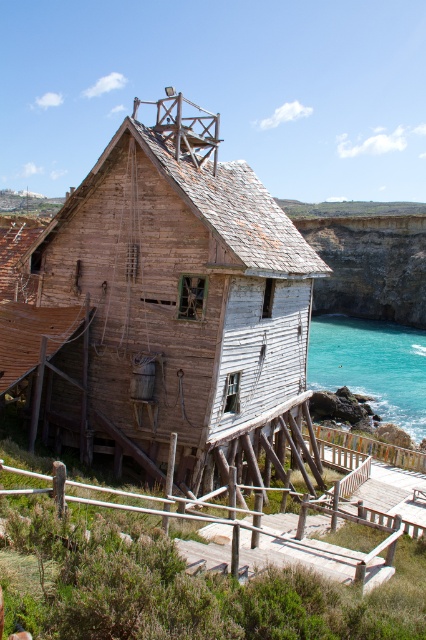
Question: Is weathered wood hut at center to the right of rugged stone cliff at right from the viewer's perspective?

Choices:
 (A) no
 (B) yes

Answer: (A)

Question: Which point is farther to the camera?

Choices:
 (A) weathered wood hut at center
 (B) turquoise water at lower right

Answer: (B)

Question: Among these points, which one is farthest from the camera?

Choices:
 (A) (261, 426)
 (B) (368, 244)
 (C) (342, 355)

Answer: (B)

Question: Does weathered wood hut at center have a lesser width compared to rugged stone cliff at right?

Choices:
 (A) yes
 (B) no

Answer: (A)

Question: Can you confirm if weathered wood hut at center is positioned to the left of turquoise water at lower right?

Choices:
 (A) no
 (B) yes

Answer: (B)

Question: Which of these objects is positioned closest to the weathered wood hut at center?

Choices:
 (A) turquoise water at lower right
 (B) rugged stone cliff at right

Answer: (A)